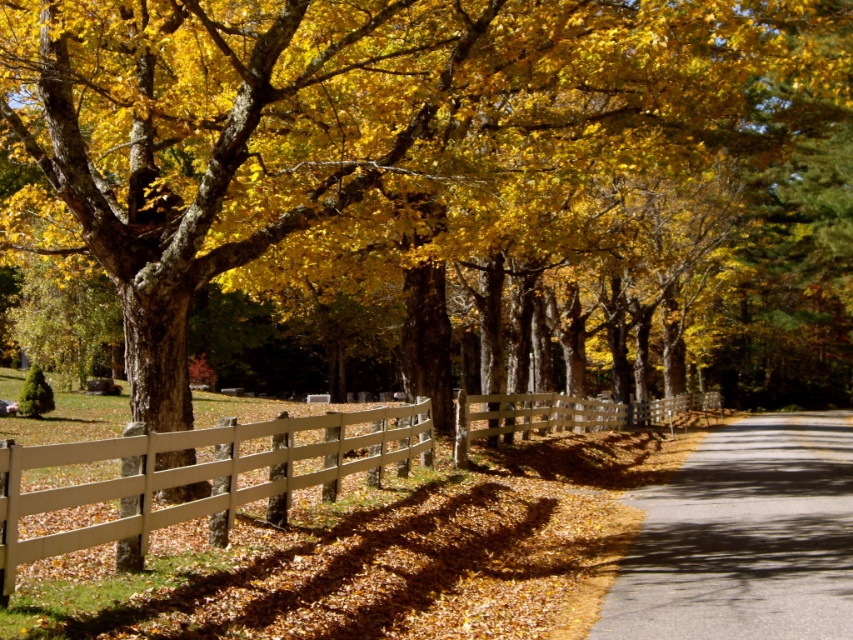
Question: Which of the following is the farthest from the observer?

Choices:
 (A) (390, 420)
 (B) (641, 616)

Answer: (A)

Question: Is gray asphalt road at center bigger than white wooden fence at center?

Choices:
 (A) yes
 (B) no

Answer: (B)

Question: Does gray asphalt road at center appear on the left side of white wooden fence at center?

Choices:
 (A) no
 (B) yes

Answer: (A)

Question: Among these objects, which one is nearest to the camera?

Choices:
 (A) gray asphalt road at center
 (B) white wooden fence at center

Answer: (B)

Question: Which point appears farthest from the camera in this image?

Choices:
 (A) (0, 476)
 (B) (821, 477)

Answer: (B)

Question: Does gray asphalt road at center have a greater width compared to white wooden fence at center?

Choices:
 (A) yes
 (B) no

Answer: (B)